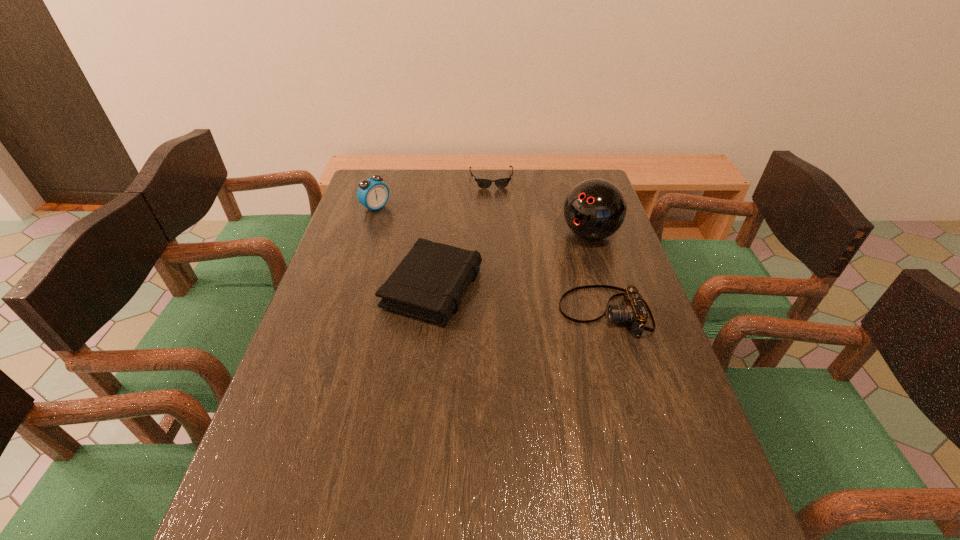
You are a GUI agent. You are given a task and a screenshot of the screen. Output one action in this format:
    pyautogui.click(x=<x>, y=<y>)
    Task: Click on the vacant space at the right edge
    
    Given the screenshot: What is the action you would take?
    pyautogui.click(x=609, y=239)

Where is `free spot at the far left corner of the desktop`? This screenshot has height=540, width=960. free spot at the far left corner of the desktop is located at coordinates (384, 176).

In order to click on vacant space at the near right corner in this screenshot , I will do `click(651, 471)`.

Find the location of `empty space between the Bible and the shortest object`. empty space between the Bible and the shortest object is located at coordinates (462, 234).

Locate an element on the screen. Image resolution: width=960 pixels, height=540 pixels. vacant space that's between the bowling ball and the camera is located at coordinates (597, 273).

You are a GUI agent. You are given a task and a screenshot of the screen. Output one action in this format:
    pyautogui.click(x=<x>, y=<y>)
    Task: Click on the free space that is in between the bowling ball and the leftmost object
    
    Given the screenshot: What is the action you would take?
    pyautogui.click(x=483, y=221)

I want to click on empty space between the leftmost object and the Bible, so click(404, 248).

What are the coordinates of `vacant region between the tallest object and the shortest object` in the screenshot? It's located at (540, 207).

Where is `free spot between the camera and the Bible`? free spot between the camera and the Bible is located at coordinates (518, 300).

The height and width of the screenshot is (540, 960). Identify the location of free space between the tallest object and the fourth nearest object. (483, 221).